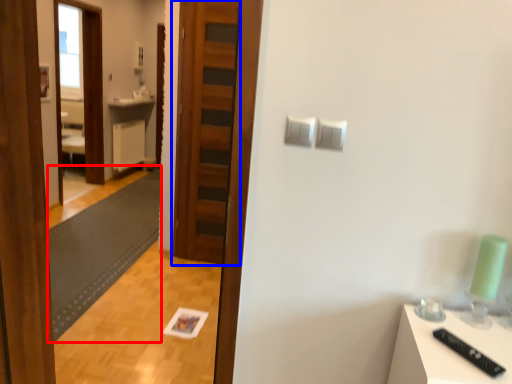
Question: Which of the following is the farthest to the observer, mat (highlighted by a red box) or door (highlighted by a blue box)?

Choices:
 (A) mat
 (B) door

Answer: (B)